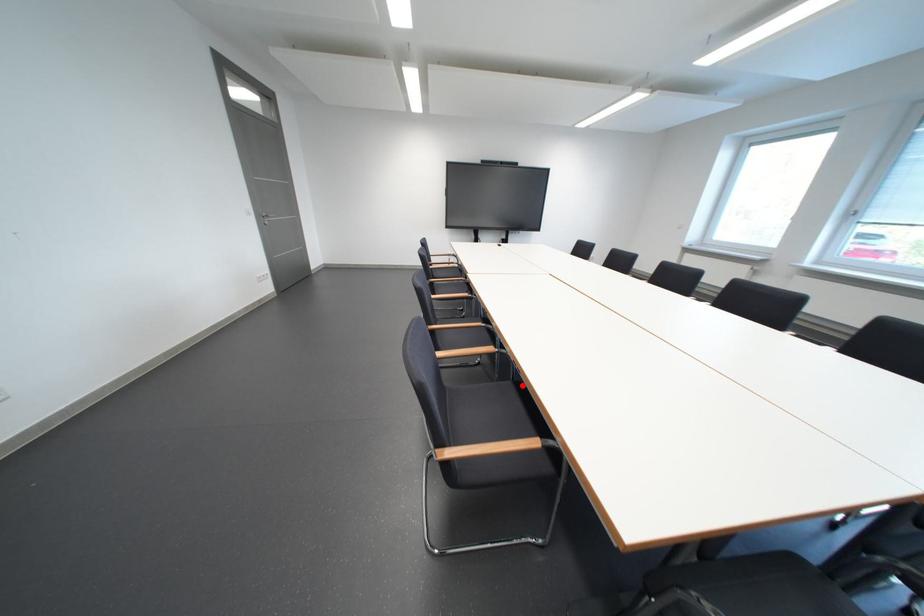
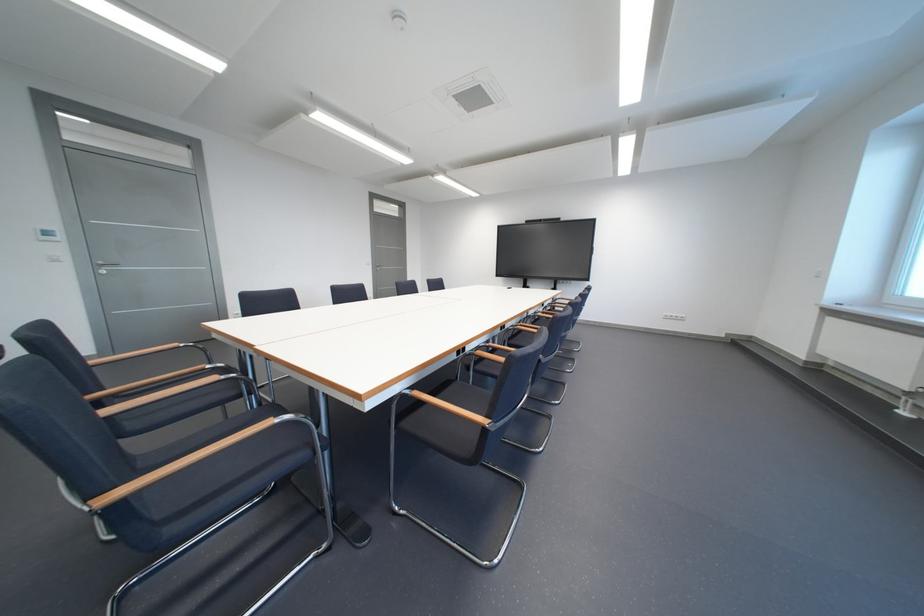
Question: I am providing you with two images of the same scene from different viewpoints. A red point is marked on the first image. At the location where the point appears in image 1, is it still visible in image 2?

Choices:
 (A) Yes
 (B) No

Answer: (B)